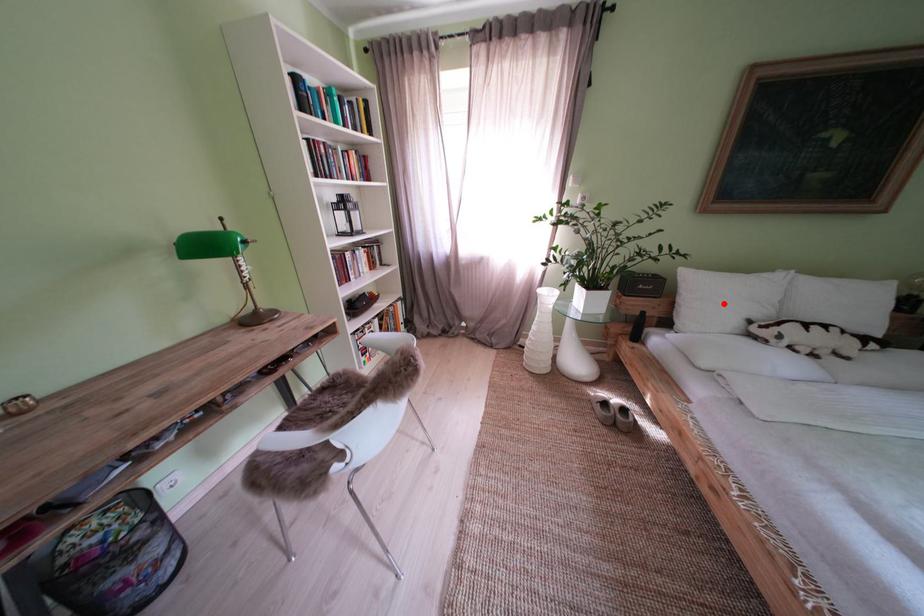
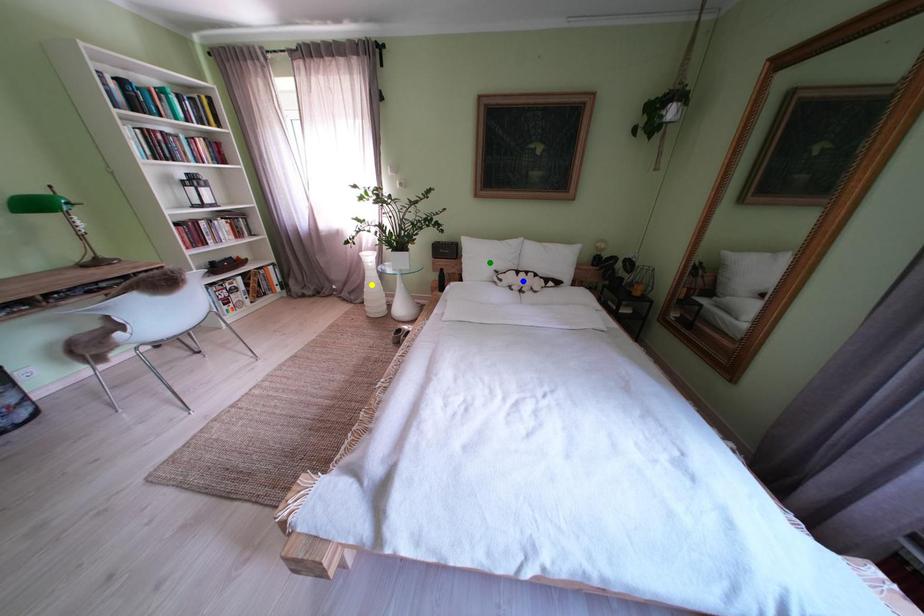
Question: I am providing you with two images of the same scene from different viewpoints. A red point is marked on the first image. You are given multiple points on the second image. Can you choose the point in image 2 that corresponds to the point in image 1?

Choices:
 (A) blue point
 (B) green point
 (C) yellow point

Answer: (B)